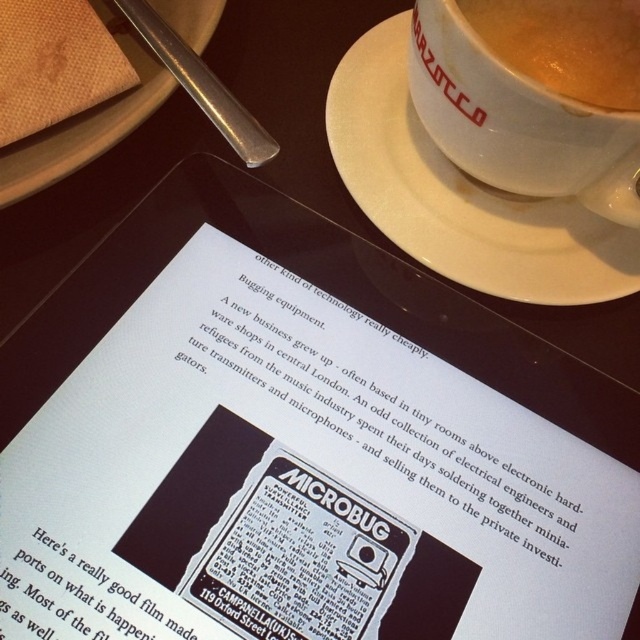
You are a server in a cafe. You need to place a new order of a latte on the table. The latte comes in a cup that is 3 inches in diameter. There is already a white paper at center and a matte white cup at upper right. Can you fit the new cup between them without moving the existing items?

The distance between the white paper at center and the matte white cup at upper right is 8.23 inches. Since the new cup has a diameter of 3 inches, there is enough space between them to place it without moving existing items.

You are a detective examining the table. You need to retrieve the white paper at center without moving the matte white cup at upper right. Is this possible?

The white paper at center is positioned under the matte white cup at upper right, so it cannot be retrieved without moving the cup.

You are organizing items on a table and need to place a small ornament that requires a flat surface. Which item, the white paper at center or the white ceramic saucer at upper center, would be more suitable for placing the ornament?

The white paper at center is larger in size than the white ceramic saucer at upper center, so it would provide a more stable and suitable surface for placing the small ornament.